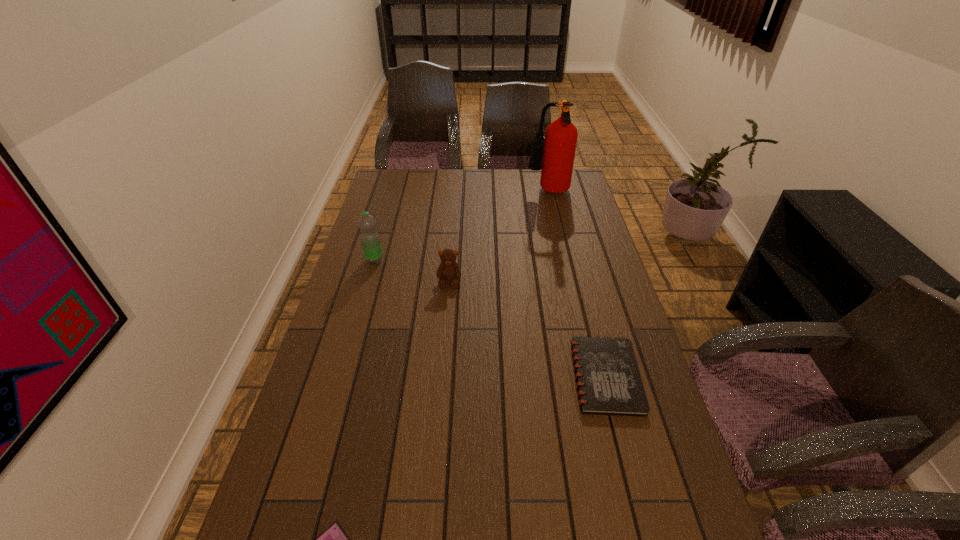
The width and height of the screenshot is (960, 540). In order to click on vacant region that satisfies the following two spatial constraints: 1. at the nozzle of the farthest object; 2. on the back side of the fourth farthest object in this screenshot , I will do `click(590, 376)`.

I want to click on vacant position in the image that satisfies the following two spatial constraints: 1. at the nozzle of the fire extinguisher; 2. on the face of the third object from left to right, so click(x=568, y=281).

The height and width of the screenshot is (540, 960). I want to click on vacant space that satisfies the following two spatial constraints: 1. on the face of the third shortest object; 2. on the left side of the second shortest object, so click(442, 376).